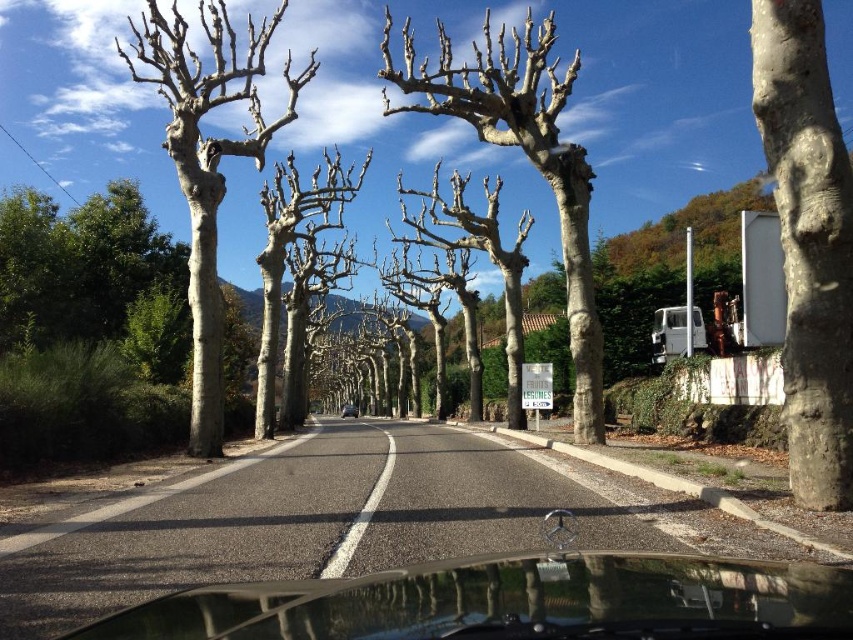
Between smooth bark tree at right and bare wood tree at center, which one appears on the right side from the viewer's perspective?

From the viewer's perspective, smooth bark tree at right appears more on the right side.

Between point (840, 333) and point (488, 19), which one is positioned behind?

The point (488, 19) is behind.

Which is in front, point (751, 17) or point (469, 90)?

Point (469, 90) is more forward.

Where is `smooth bark tree at right`? smooth bark tree at right is located at coordinates (808, 243).

Can you confirm if bare wood tree at center is wider than white asphalt road at center?

Indeed, bare wood tree at center has a greater width compared to white asphalt road at center.

Is bare wood tree at center bigger than white asphalt road at center?

Yes.

What do you see at coordinates (526, 157) in the screenshot? I see `bare wood tree at center` at bounding box center [526, 157].

Locate an element on the screen. The width and height of the screenshot is (853, 640). bare wood tree at center is located at coordinates (526, 157).

Does smooth bark tree at center have a smaller size compared to white asphalt road at center?

Actually, smooth bark tree at center might be larger than white asphalt road at center.

Identify the location of smooth bark tree at center. (285, 256).